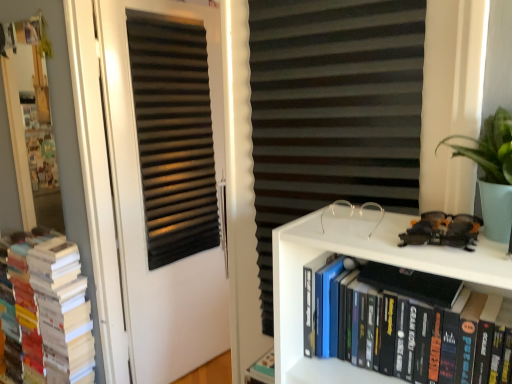
Question: From a real-world perspective, is shiny plastic toy car at upper right physically located above or below black matte bookshelf at lower right, which is counted as the second book, starting from the left?

Choices:
 (A) below
 (B) above

Answer: (B)

Question: From the image's perspective, is shiny plastic toy car at upper right located above or below black matte bookshelf at lower right, which is the 1th book from front to back?

Choices:
 (A) below
 (B) above

Answer: (B)

Question: Considering the real-world distances, which object is closest to the shiny plastic toy car at upper right?

Choices:
 (A) black matte bookshelf at lower right, which is the 1th book from front to back
 (B) black matte door at center
 (C) clear plastic glasses at upper center
 (D) black matte curtain at upper center
 (E) white paper books at left, which appears as the 2th book when viewed from the right

Answer: (C)

Question: Based on their relative distances, which object is farther from the white paper books at left, which is counted as the second book, starting from the front?

Choices:
 (A) black matte curtain at upper center
 (B) clear plastic glasses at upper center
 (C) black matte bookshelf at lower right, which is the 2th book in back-to-front order
 (D) black matte door at center
 (E) shiny plastic toy car at upper right

Answer: (E)